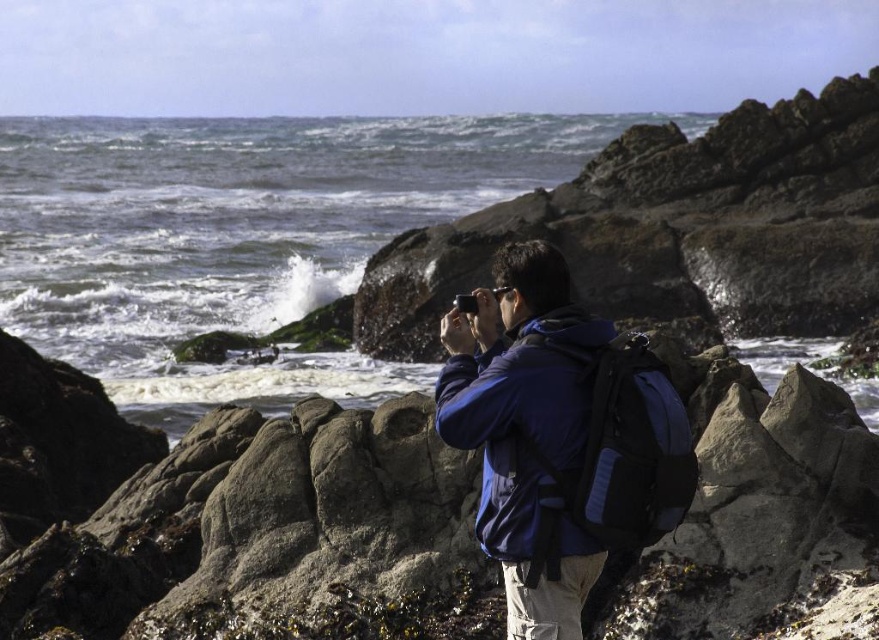
You are a photographer standing on the rocky coastline. You notice the rough stone rocks at center and the clear water at center in your viewfinder. Which object is positioned to the right in the scene?

The rough stone rocks at center is to the right of clear water at center according to the description.

You are standing at the rocky coastline scene. There is a point at coordinates point (496, 609). If you want to place a 10 meter long safety rope from your current position to that point, will it be sufficient? Please answer based on the distance provided.

The distance of point (496, 609) from viewer is 15.51 meters. Since the safety rope is only 10 meters long, it will not be sufficient to reach that point.

You are standing at the rocky coastline scene and want to place a small flag at the point closer to you between point (705,627) and point (500,484). Which point should you choose?

You should choose point (705,627) because it is closer to you than point (500,484).